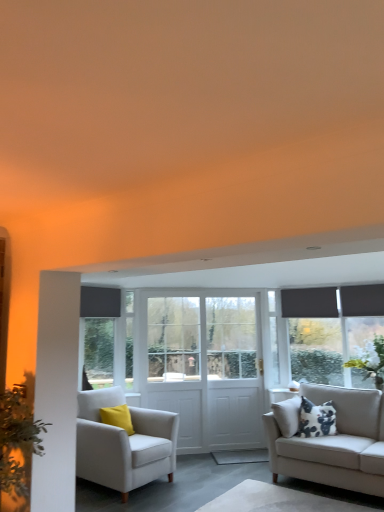
Describe the element at coordinates (233, 373) in the screenshot. I see `white wooden door at center, which is counted as the second screen door, starting from the left` at that location.

What is the approximate height of white wooden door at center, which is the first screen door in right-to-left order?

The height of white wooden door at center, which is the first screen door in right-to-left order, is 2.23 meters.

The height and width of the screenshot is (512, 384). I want to click on beige fabric couch at right, so click(335, 443).

How much space does white wooden screen door at center, which ranks as the second screen door in right-to-left order, occupy vertically?

It is 2.21 meters.

Identify the location of white textured plant at right, the 1th plant from the right. (370, 362).

Consider the image. What is the approximate width of dark gray roller blind at left?

dark gray roller blind at left is 11.35 centimeters in width.

What do you see at coordinates (18, 442) in the screenshot? I see `green leafy plant at left, the 1th plant positioned from the front` at bounding box center [18, 442].

This screenshot has height=512, width=384. Identify the location of white wooden door at center, which is the first screen door in right-to-left order. (233, 373).

From a real-world perspective, is dark gray roller blind at left above or below white fabric armchair at left?

In terms of real-world spatial position, dark gray roller blind at left is above white fabric armchair at left.

Which is behind, dark gray roller blind at left or white fabric armchair at left?

dark gray roller blind at left.

Who is bigger, dark gray roller blind at left or white fabric armchair at left?

white fabric armchair at left is bigger.

Is dark gray roller blind at left positioned with its back to white fabric armchair at left?

No, white fabric armchair at left is not at the back of dark gray roller blind at left.

Is white wooden door at center, which is the first screen door in right-to-left order, bigger than beige fabric couch at right?

Actually, white wooden door at center, which is the first screen door in right-to-left order, might be smaller than beige fabric couch at right.

Which is behind, point (209, 369) or point (361, 394)?

The point (209, 369) is behind.

Considering their positions, is white wooden door at center, which is counted as the second screen door, starting from the left, located in front of or behind beige fabric couch at right?

white wooden door at center, which is counted as the second screen door, starting from the left, is positioned farther from the viewer than beige fabric couch at right.

Is beige fabric couch at right facing away from dark gray roller blind at left?

No, beige fabric couch at right's orientation is not away from dark gray roller blind at left.

What's the angular difference between beige fabric couch at right and dark gray roller blind at left's facing directions?

The angular difference between beige fabric couch at right and dark gray roller blind at left is 87.4 degrees.

From a real-world perspective, between beige fabric couch at right and dark gray roller blind at left, who is vertically higher?

dark gray roller blind at left.

Considering the sizes of beige fabric couch at right and dark gray roller blind at left in the image, is beige fabric couch at right wider or thinner than dark gray roller blind at left?

beige fabric couch at right is wider than dark gray roller blind at left.

Can you confirm if white wooden screen door at center, which ranks as the second screen door in right-to-left order, is shorter than dark gray roller blind at left?

No, white wooden screen door at center, which ranks as the second screen door in right-to-left order, is not shorter than dark gray roller blind at left.

Identify the location of the 2nd screen door located beneath the dark gray roller blind at left (from a real-world perspective). The height and width of the screenshot is (512, 384). (x=176, y=362).

Does white wooden screen door at center, acting as the 1th screen door starting from the left, turn towards dark gray roller blind at left?

No, white wooden screen door at center, acting as the 1th screen door starting from the left, is not turned towards dark gray roller blind at left.

Between white wooden screen door at center, which ranks as the second screen door in right-to-left order, and dark gray roller blind at left, which one is positioned in front?

dark gray roller blind at left is closer to the camera.

From the image's perspective, between dark gray roller blind at left and white wooden door at center, who is located below?

white wooden door at center is shown below in the image.

Which of these two, dark gray roller blind at left or white wooden door at center, is bigger?

With larger size is white wooden door at center.

From a real-world perspective, does dark gray roller blind at left sit lower than white wooden door at center?

Actually, dark gray roller blind at left is physically above white wooden door at center in the real world.

Who is taller, dark gray roller blind at left or white wooden door at center?

Standing taller between the two is white wooden door at center.

Is there a large distance between white fabric rug at lower center and white wooden screen door at center, acting as the 1th screen door starting from the left?

Indeed, white fabric rug at lower center is not near white wooden screen door at center, acting as the 1th screen door starting from the left.

From a real-world perspective, who is located higher, white fabric rug at lower center or white wooden screen door at center, acting as the 1th screen door starting from the left?

white wooden screen door at center, acting as the 1th screen door starting from the left.

Between white fabric rug at lower center and white wooden screen door at center, which ranks as the second screen door in right-to-left order, which one is positioned behind?

white wooden screen door at center, which ranks as the second screen door in right-to-left order, is more distant.

From the image's perspective, would you say white fabric rug at lower center is positioned over white wooden screen door at center, acting as the 1th screen door starting from the left?

No.

Is green leafy plant at left, the first plant positioned from the left, positioned far away from white textured plant at right, the second plant in the left-to-right sequence?

green leafy plant at left, the first plant positioned from the left, is positioned a significant distance from white textured plant at right, the second plant in the left-to-right sequence.

Considering the relative sizes of green leafy plant at left, the 1th plant positioned from the front, and white textured plant at right, positioned as the first plant in back-to-front order, in the image provided, is green leafy plant at left, the 1th plant positioned from the front, thinner than white textured plant at right, positioned as the first plant in back-to-front order,?

No, green leafy plant at left, the 1th plant positioned from the front, is not thinner than white textured plant at right, positioned as the first plant in back-to-front order.

Could you measure the distance between green leafy plant at left, which is the second plant in right-to-left order, and white textured plant at right, arranged as the 2th plant when viewed from the front?

green leafy plant at left, which is the second plant in right-to-left order, and white textured plant at right, arranged as the 2th plant when viewed from the front, are 4.23 meters apart from each other.

Considering the relative sizes of green leafy plant at left, the second plant from the back, and white textured plant at right, the 1th plant from the right, in the image provided, is green leafy plant at left, the second plant from the back, shorter than white textured plant at right, the 1th plant from the right,?

No.

Locate an element on the screen. chair below the dark gray roller blind at left (from a real-world perspective) is located at coordinates (123, 443).

Where is `studio couch located below the white wooden door at center, which is counted as the second screen door, starting from the left (from the image's perspective)`? Image resolution: width=384 pixels, height=512 pixels. studio couch located below the white wooden door at center, which is counted as the second screen door, starting from the left (from the image's perspective) is located at coordinates (335, 443).

Considering their positions, is white fabric rug at lower center positioned further to beige fabric couch at right than white fabric armchair at left?

Based on the image, white fabric armchair at left appears to be further to beige fabric couch at right.

Estimate the real-world distances between objects in this image. Which object is further from white wooden door at center, green leafy plant at left, the 1th plant positioned from the front, or white textured plant at right, positioned as the first plant in back-to-front order?

Among the two, green leafy plant at left, the 1th plant positioned from the front, is located further to white wooden door at center.

When comparing their distances from white textured plant at right, positioned as the first plant in back-to-front order, does green leafy plant at left, the second plant from the back, or white wooden door at center seem closer?

white wooden door at center lies closer to white textured plant at right, positioned as the first plant in back-to-front order, than the other object.

Based on their spatial positions, is white wooden screen door at center, which ranks as the second screen door in right-to-left order, or white fabric armchair at left further from white wooden door at center, which is the first screen door in right-to-left order?

white fabric armchair at left is further to white wooden door at center, which is the first screen door in right-to-left order.

Based on their spatial positions, is white wooden door at center, which is counted as the second screen door, starting from the left, or beige fabric couch at right closer to white textured plant at right, the second plant in the left-to-right sequence?

Based on the image, white wooden door at center, which is counted as the second screen door, starting from the left, appears to be nearer to white textured plant at right, the second plant in the left-to-right sequence.

From the image, which object appears to be nearer to beige fabric couch at right, white textured plant at right, the 1th plant from the right, or white fabric armchair at left?

white fabric armchair at left is positioned closer to the anchor beige fabric couch at right.

From the image, which object appears to be farther from white wooden door at center, which is the first screen door in right-to-left order, white wooden screen door at center, acting as the 1th screen door starting from the left, or white textured plant at right, arranged as the 2th plant when viewed from the front?

Based on the image, white textured plant at right, arranged as the 2th plant when viewed from the front, appears to be further to white wooden door at center, which is the first screen door in right-to-left order.

Based on their spatial positions, is white textured plant at right, arranged as the 2th plant when viewed from the front, or white wooden door at center closer to white wooden door at center, which is counted as the second screen door, starting from the left?

white wooden door at center is positioned closer to the anchor white wooden door at center, which is counted as the second screen door, starting from the left.

The height and width of the screenshot is (512, 384). Find the location of `studio couch between green leafy plant at left, the second plant from the back, and white textured plant at right, positioned as the first plant in back-to-front order, in the horizontal direction`. studio couch between green leafy plant at left, the second plant from the back, and white textured plant at right, positioned as the first plant in back-to-front order, in the horizontal direction is located at coordinates (335, 443).

The height and width of the screenshot is (512, 384). Find the location of `studio couch between white fabric armchair at left and white textured plant at right, the second plant in the left-to-right sequence`. studio couch between white fabric armchair at left and white textured plant at right, the second plant in the left-to-right sequence is located at coordinates (335, 443).

Find the location of `table between white fabric armchair at left and beige fabric couch at right from left to right`. table between white fabric armchair at left and beige fabric couch at right from left to right is located at coordinates coord(278,500).

Identify the location of screen door between dark gray roller blind at left and white wooden door at center in the horizontal direction. (176, 362).